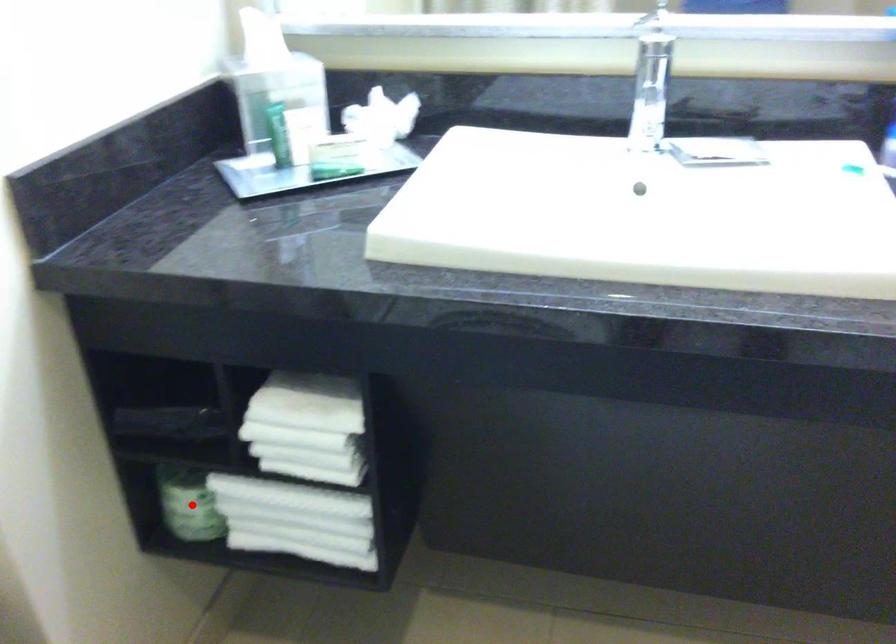
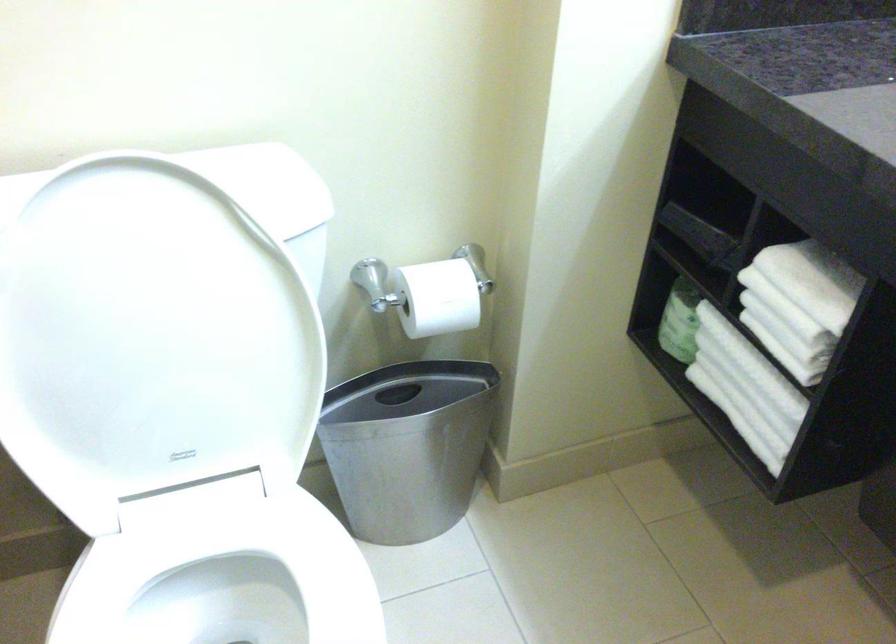
Where in the second image is the point corresponding to the highlighted location from the first image?

(679, 321)